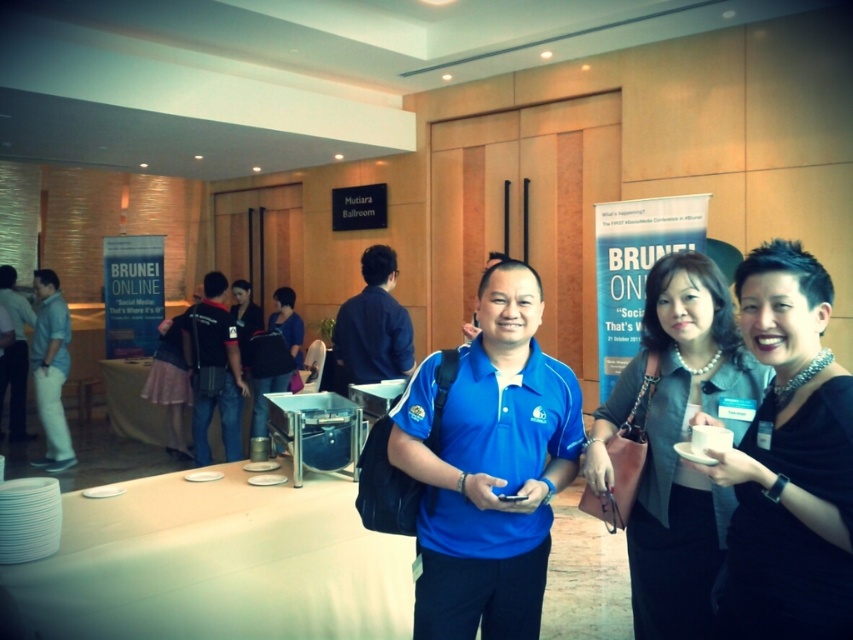
Question: Is blue matte shirt at center smaller than black satin dress at center?

Choices:
 (A) yes
 (B) no

Answer: (B)

Question: Which of the following is the farthest from the observer?

Choices:
 (A) dark blue shirt at center
 (B) blue matte shirt at center
 (C) matte white pants at left
 (D) blue fabric shirt at center

Answer: (C)

Question: Which point is closer to the camera taking this photo?

Choices:
 (A) (297, 348)
 (B) (654, 289)
 (C) (799, 577)

Answer: (C)

Question: Is black satin dress at center to the left of dark blue shirt at center from the viewer's perspective?

Choices:
 (A) no
 (B) yes

Answer: (A)

Question: Is pearl necklace at upper center closer to the viewer compared to blue fabric shirt at center?

Choices:
 (A) yes
 (B) no

Answer: (A)

Question: Which is nearer to the light blue shirt at center?

Choices:
 (A) blue matte shirt at center
 (B) pearl necklace at upper center
 (C) matte white pants at left

Answer: (C)